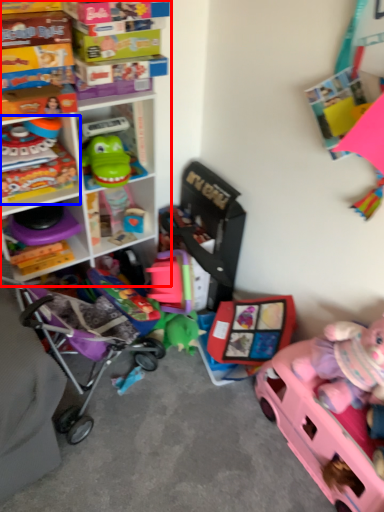
Question: Which of the following is the closest to the observer, shelf (highlighted by a red box) or toy (highlighted by a blue box)?

Choices:
 (A) shelf
 (B) toy

Answer: (A)